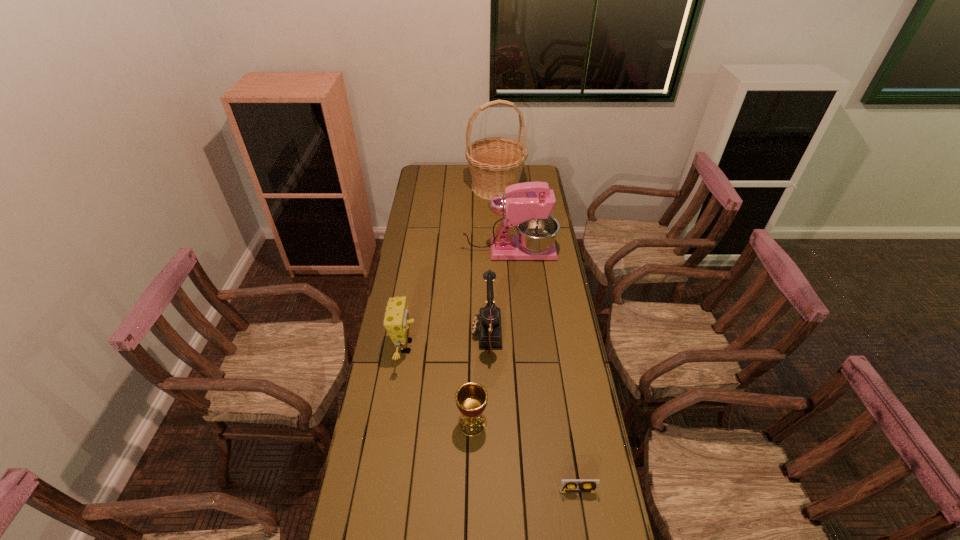
Locate an element on the screen. The width and height of the screenshot is (960, 540). basket is located at coordinates (495, 163).

Identify the location of the farthest object. (495, 163).

Find the location of a particular element. the second farthest object is located at coordinates (528, 206).

Find the location of a particular element. The width and height of the screenshot is (960, 540). the second tallest object is located at coordinates (528, 206).

Locate an element on the screen. Image resolution: width=960 pixels, height=540 pixels. telephone is located at coordinates (488, 323).

In order to click on sponge in this screenshot , I will do pos(396,321).

The height and width of the screenshot is (540, 960). In order to click on the leftmost object in this screenshot , I will do `click(396, 321)`.

The height and width of the screenshot is (540, 960). What are the coordinates of `the second shortest object` in the screenshot? It's located at (471, 398).

Image resolution: width=960 pixels, height=540 pixels. Find the location of `the second nearest object`. the second nearest object is located at coordinates (471, 398).

Image resolution: width=960 pixels, height=540 pixels. I want to click on the nearest object, so click(x=567, y=485).